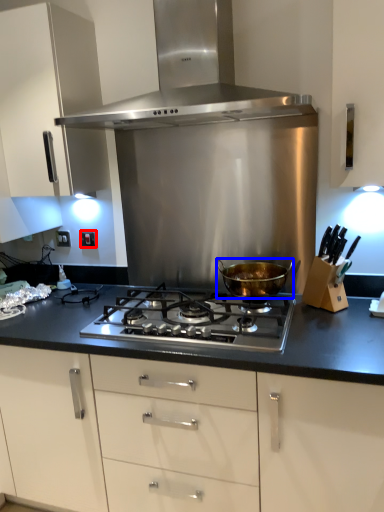
Question: Which point is further to the camera, electric outlet (highlighted by a red box) or kitchen appliance (highlighted by a blue box)?

Choices:
 (A) electric outlet
 (B) kitchen appliance

Answer: (A)